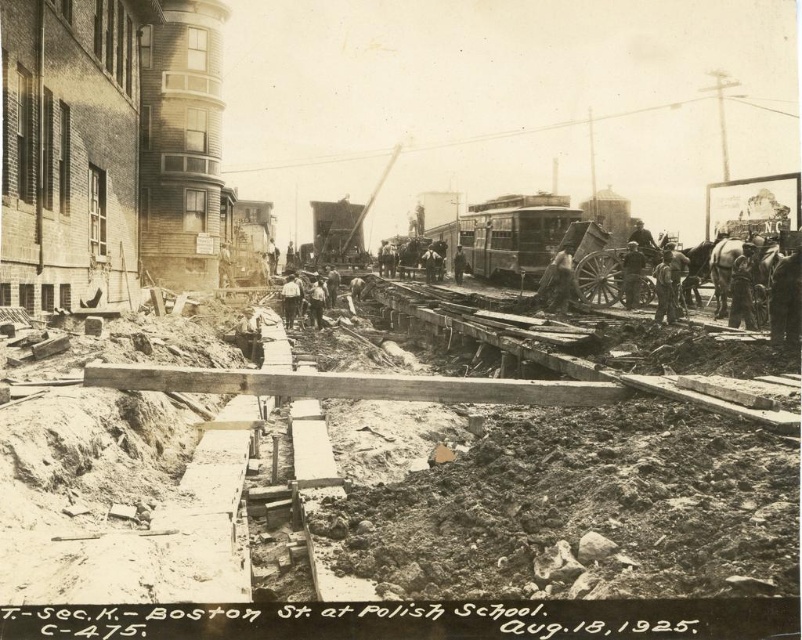
Based on the scene at Boston Street construction site, can you determine if the wooden planks at center are positioned above or below the metallic silver train car at center?

The wooden planks at center are below the metallic silver train car at center according to the description.

You are a safety inspector at the construction site. You notice the wooden planks at center and the dark gray fabric shirt at center. Which object is shorter in height?

The wooden planks at center are shorter in height compared to the dark gray fabric shirt at center.

You are a construction worker at the site and need to move a tool from the metallic silver train car at center to the dark gray fabric shirt at center. Considering their sizes, which object requires more space to handle?

The metallic silver train car at center requires more space to handle because its width is larger than the dark gray fabric shirt at center.